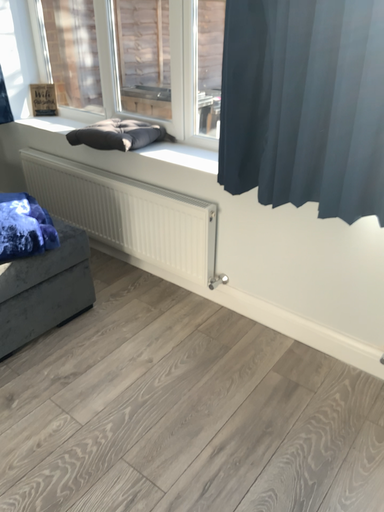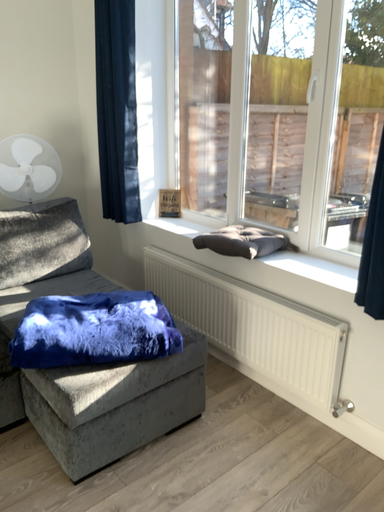
Question: How did the camera likely rotate when shooting the video?

Choices:
 (A) rotated upward
 (B) rotated downward

Answer: (A)